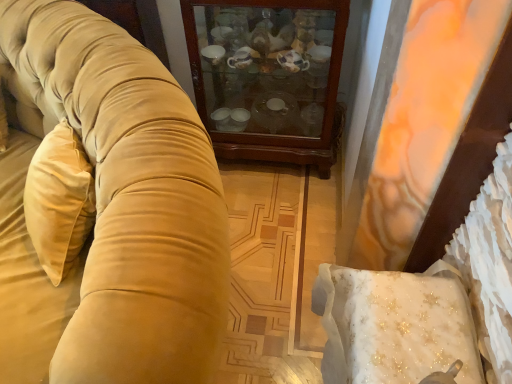
What do you see at coordinates (104, 209) in the screenshot? The image size is (512, 384). I see `velvet gold couch at left` at bounding box center [104, 209].

What are the coordinates of `velvet gold couch at left` in the screenshot? It's located at (104, 209).

The height and width of the screenshot is (384, 512). Find the location of `wooden cabinet at center`. wooden cabinet at center is located at coordinates (268, 77).

The image size is (512, 384). What do you see at coordinates (268, 77) in the screenshot?
I see `wooden cabinet at center` at bounding box center [268, 77].

Locate an element on the screen. velvet gold couch at left is located at coordinates (104, 209).

Between wooden cabinet at center and velvet gold couch at left, which one appears on the right side from the viewer's perspective?

wooden cabinet at center.

Which is behind, wooden cabinet at center or velvet gold couch at left?

wooden cabinet at center.

Does point (223, 93) appear closer or farther from the camera than point (134, 312)?

Point (223, 93).

From the image's perspective, which one is positioned lower, wooden cabinet at center or velvet gold couch at left?

From the image's view, velvet gold couch at left is below.

From a real-world perspective, is wooden cabinet at center above or below velvet gold couch at left?

Clearly, from a real-world perspective, wooden cabinet at center is below velvet gold couch at left.

Which of these two, wooden cabinet at center or velvet gold couch at left, is wider?

velvet gold couch at left.

Between wooden cabinet at center and velvet gold couch at left, which one has less height?

wooden cabinet at center.

Between wooden cabinet at center and velvet gold couch at left, which one has larger size?

velvet gold couch at left.

Would you say wooden cabinet at center is outside velvet gold couch at left?

Yes, wooden cabinet at center is not within velvet gold couch at left.

Is wooden cabinet at center touching velvet gold couch at left?

There is a gap between wooden cabinet at center and velvet gold couch at left.

Is wooden cabinet at center oriented away from velvet gold couch at left?

wooden cabinet at center is not turned away from velvet gold couch at left.

How different are the orientations of wooden cabinet at center and velvet gold couch at left in degrees?

The facing directions of wooden cabinet at center and velvet gold couch at left are 4.62 degrees apart.

How distant is wooden cabinet at center from velvet gold couch at left?

30.23 inches.

Locate an element on the screen. furniture below the velvet gold couch at left (from a real-world perspective) is located at coordinates (268, 77).

Can you confirm if velvet gold couch at left is positioned to the left of wooden cabinet at center?

Indeed, velvet gold couch at left is positioned on the left side of wooden cabinet at center.

From the picture: Considering their positions, is velvet gold couch at left located in front of or behind wooden cabinet at center?

Visually, velvet gold couch at left is located in front of wooden cabinet at center.

Is point (151, 213) positioned behind point (318, 96)?

No.

From the image's perspective, which one is positioned lower, velvet gold couch at left or wooden cabinet at center?

From the image's view, velvet gold couch at left is below.

From a real-world perspective, which object rests below the other?

wooden cabinet at center is physically lower.

Which of these two, velvet gold couch at left or wooden cabinet at center, is wider?

Wider between the two is velvet gold couch at left.

Considering the sizes of velvet gold couch at left and wooden cabinet at center in the image, is velvet gold couch at left taller or shorter than wooden cabinet at center?

Considering their sizes, velvet gold couch at left has more height than wooden cabinet at center.

Does velvet gold couch at left have a smaller size compared to wooden cabinet at center?

Incorrect, velvet gold couch at left is not smaller in size than wooden cabinet at center.

Choose the correct answer: Is velvet gold couch at left inside wooden cabinet at center or outside it?

The correct answer is: outside.

Is velvet gold couch at left not near wooden cabinet at center?

That's not correct — velvet gold couch at left is a little close to wooden cabinet at center.

Could you tell me if velvet gold couch at left is turned towards wooden cabinet at center?

No, velvet gold couch at left is not oriented towards wooden cabinet at center.

Can you tell me how much velvet gold couch at left and wooden cabinet at center differ in facing direction?

4.62 degrees.

Locate an element on the screen. The width and height of the screenshot is (512, 384). furniture lying on the right of velvet gold couch at left is located at coordinates (268, 77).

Locate an element on the screen. The image size is (512, 384). furniture on the right of the velvet gold couch at left is located at coordinates pyautogui.click(x=268, y=77).

You are a GUI agent. You are given a task and a screenshot of the screen. Output one action in this format:
    pyautogui.click(x=<x>, y=<y>)
    Task: Click on the studio couch that appears above the wooden cabinet at center (from a real-world perspective)
    
    Given the screenshot: What is the action you would take?
    pyautogui.click(x=104, y=209)